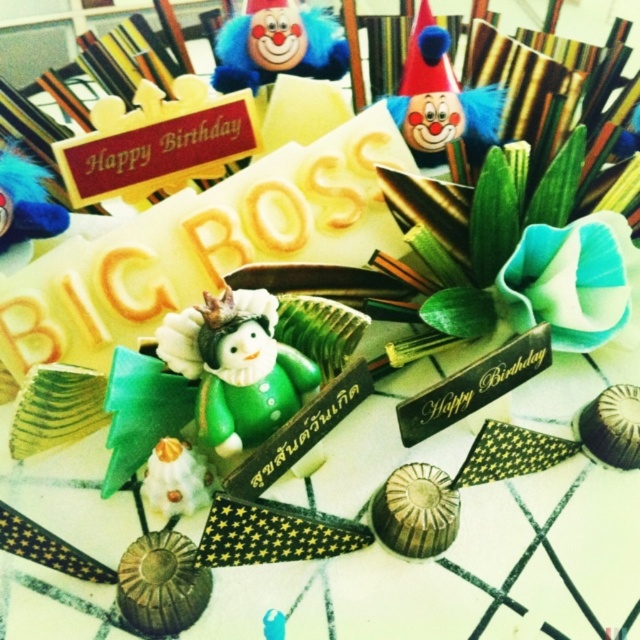
Does matte clown head at upper center appear over blue feather at upper left?

Correct, matte clown head at upper center is located above blue feather at upper left.

Can you confirm if matte clown head at upper center is wider than blue feather at upper left?

Yes, matte clown head at upper center is wider than blue feather at upper left.

The image size is (640, 640). I want to click on matte clown head at upper center, so click(442, 100).

This screenshot has width=640, height=640. What are the coordinates of `matte clown head at upper center` in the screenshot? It's located at (442, 100).

Describe the element at coordinates (236, 368) in the screenshot. I see `green clay figurine at center` at that location.

Between green clay figurine at center and blue plush clown at upper center, which one is positioned higher?

blue plush clown at upper center is above.

The height and width of the screenshot is (640, 640). I want to click on green clay figurine at center, so click(x=236, y=368).

Locate an element on the screen. This screenshot has height=640, width=640. green clay figurine at center is located at coordinates (236, 368).

Is green clay figurine at center thinner than matte clown head at upper center?

Correct, green clay figurine at center's width is less than matte clown head at upper center's.

Does point (218, 390) come in front of point (433, 58)?

Yes, point (218, 390) is in front of point (433, 58).

Locate an element on the screen. green clay figurine at center is located at coordinates (236, 368).

Identify the location of green clay figurine at center. Image resolution: width=640 pixels, height=640 pixels. click(236, 368).